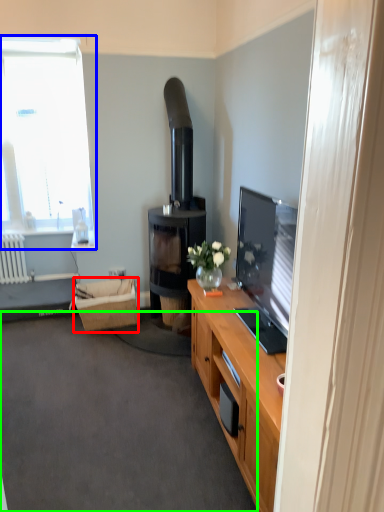
Question: Based on their relative distances, which object is nearer to picnic basket (highlighted by a red box)? Choose from window (highlighted by a blue box) and plain (highlighted by a green box).

Choices:
 (A) window
 (B) plain

Answer: (B)